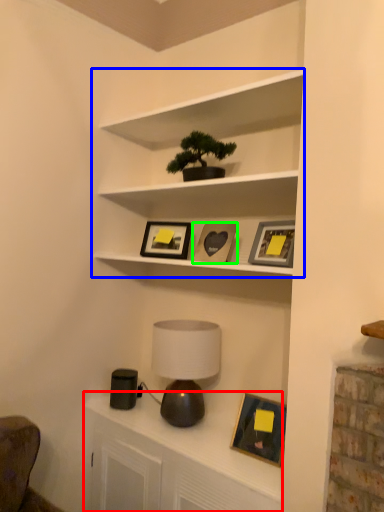
Question: Which object is positioned farthest from dresser (highlighted by a red box)? Select from shelf (highlighted by a blue box) and picture frame (highlighted by a green box).

Choices:
 (A) shelf
 (B) picture frame

Answer: (A)